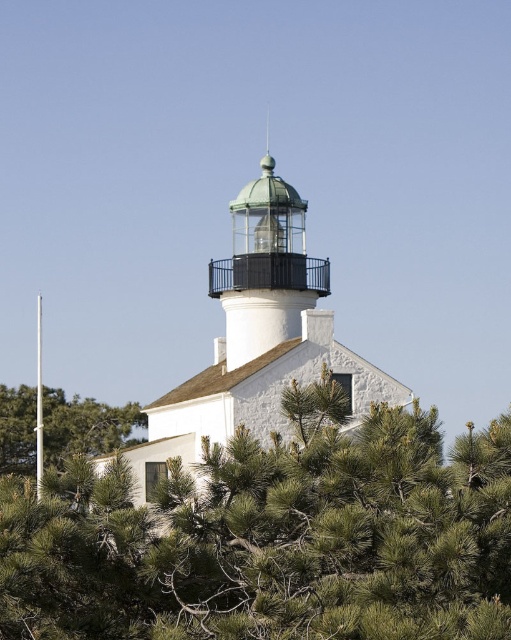
Question: Among these points, which one is nearest to the camera?

Choices:
 (A) [80, 604]
 (B) [225, 294]

Answer: (A)

Question: Based on their relative distances, which object is farther from the green needle-like tree at left?

Choices:
 (A) metallic glass dome at center
 (B) green needle-like at center

Answer: (B)

Question: Does green needle-like at center appear on the right side of metallic glass dome at center?

Choices:
 (A) yes
 (B) no

Answer: (B)

Question: Is green needle-like at center further to camera compared to metallic glass dome at center?

Choices:
 (A) no
 (B) yes

Answer: (A)

Question: From the image, what is the correct spatial relationship of green needle-like at center in relation to green needle-like tree at left?

Choices:
 (A) above
 (B) below

Answer: (A)

Question: Which of the following is the farthest from the observer?

Choices:
 (A) (401, 525)
 (B) (309, 285)

Answer: (B)